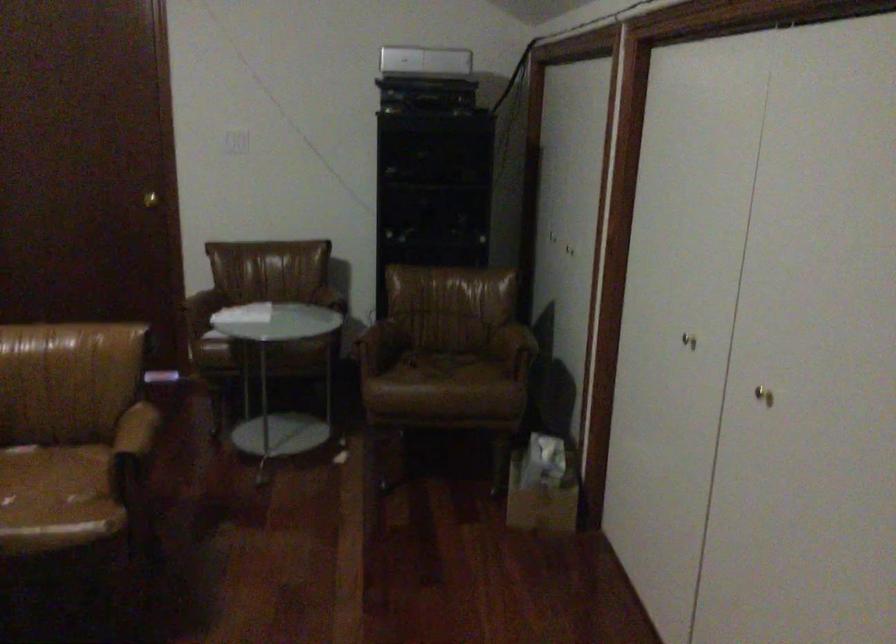
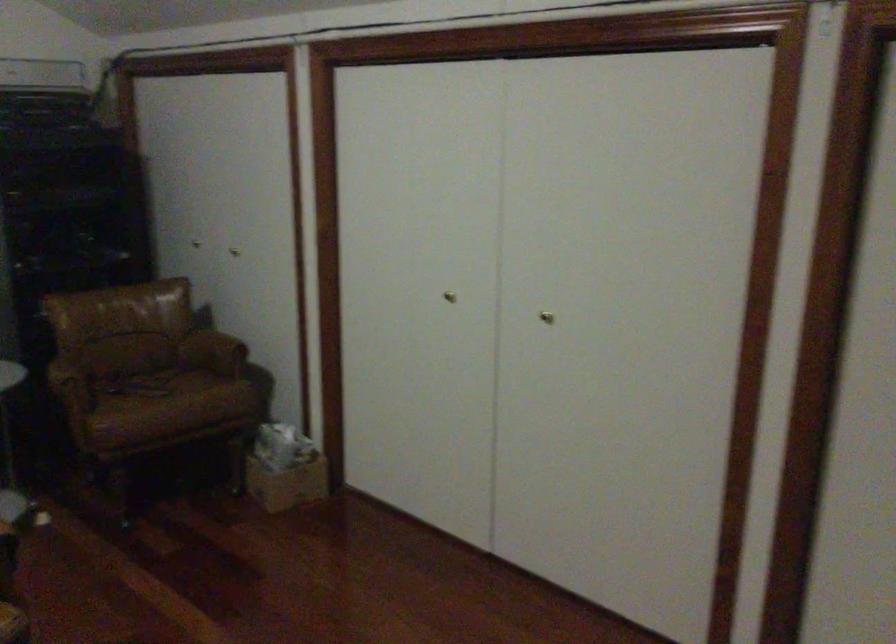
Where in the second image is the point corresponding to (x=528, y=504) from the first image?

(287, 484)